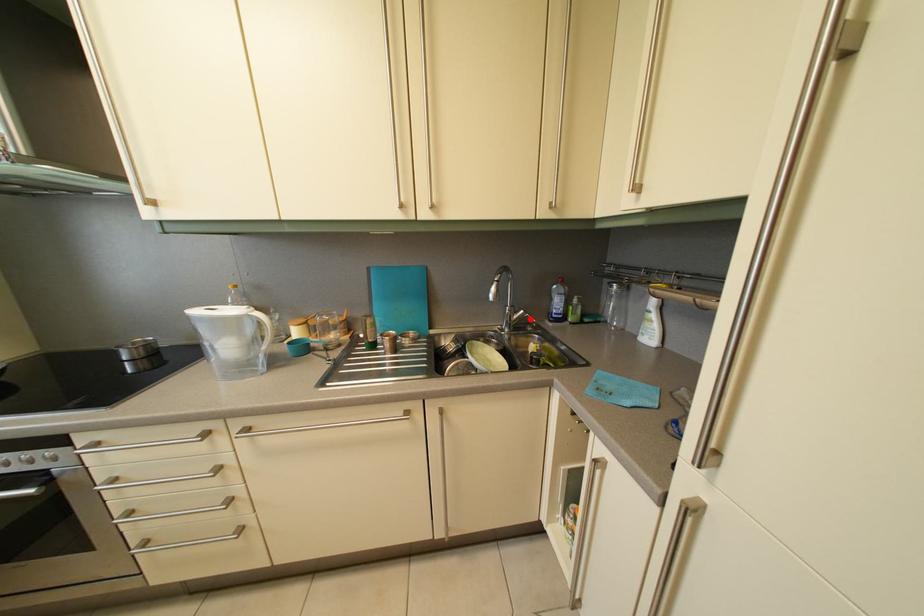
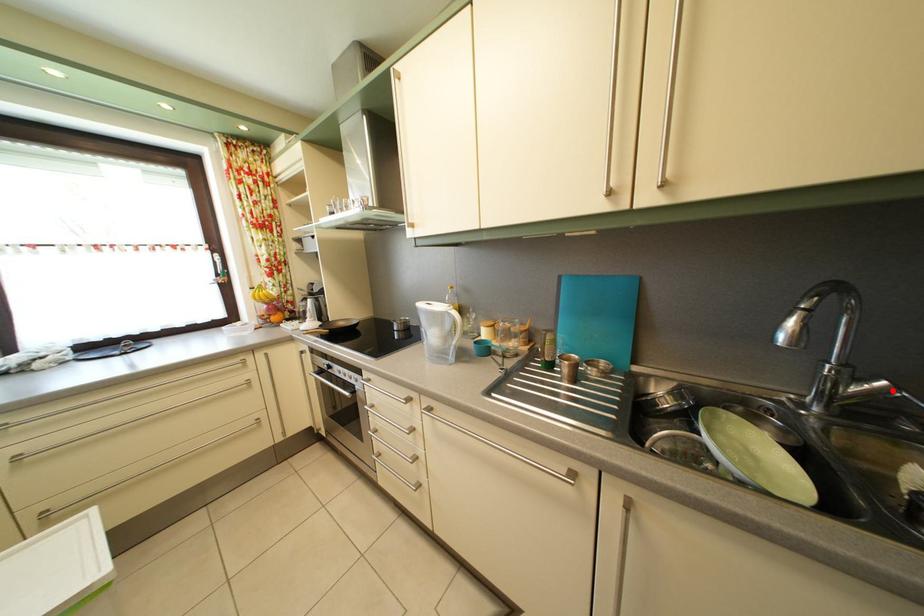
I am providing you with two images of the same scene from different viewpoints. A red point is marked on the first image and another point is marked on the second image. Is the marked point in image1 the same physical position as the marked point in image2?

Yes